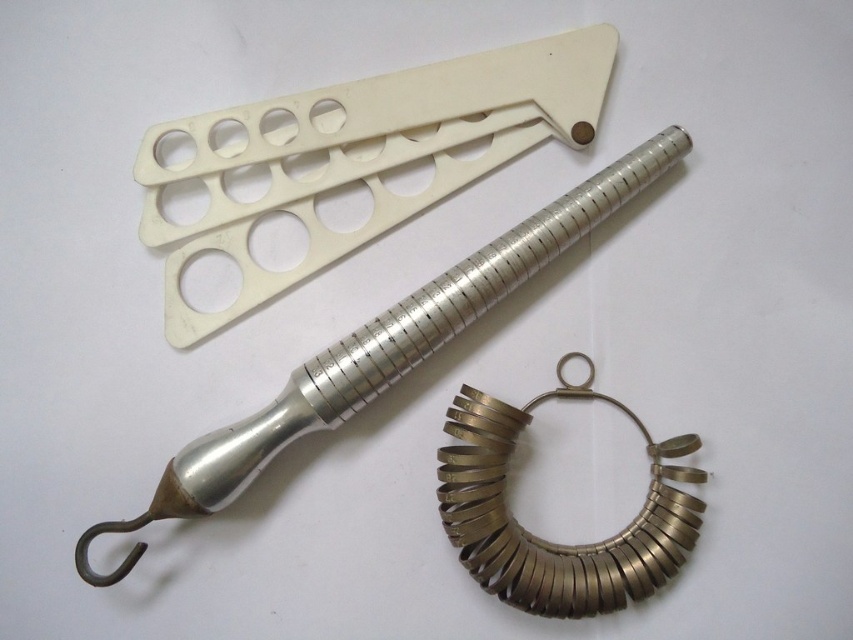
Does silver metallic hook at lower left appear on the left side of gold metallic ring at lower center?

Indeed, silver metallic hook at lower left is positioned on the left side of gold metallic ring at lower center.

Which is more to the left, silver metallic hook at lower left or gold metallic ring at lower center?

From the viewer's perspective, silver metallic hook at lower left appears more on the left side.

Locate an element on the screen. The width and height of the screenshot is (853, 640). silver metallic hook at lower left is located at coordinates (383, 349).